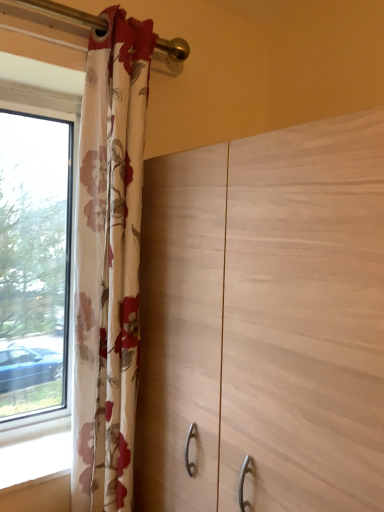
Locate an element on the screen. light wood dresser at center is located at coordinates (265, 321).

Describe the element at coordinates (265, 321) in the screenshot. I see `light wood dresser at center` at that location.

What do you see at coordinates (109, 263) in the screenshot? The image size is (384, 512). I see `floral fabric curtain at left` at bounding box center [109, 263].

At what (x,y) coordinates should I click in order to perform the action: click on floral fabric curtain at left. Please return your answer as a coordinate pair (x, y). Looking at the image, I should click on (109, 263).

Where is `light wood dresser at center`? light wood dresser at center is located at coordinates (265, 321).

Considering the positions of objects floral fabric curtain at left and light wood dresser at center in the image provided, who is more to the left, floral fabric curtain at left or light wood dresser at center?

floral fabric curtain at left.

Does floral fabric curtain at left come behind light wood dresser at center?

Yes, it is.

Between point (85, 433) and point (347, 429), which one is positioned behind?

The point (85, 433) is farther from the camera.

From the image's perspective, is floral fabric curtain at left located beneath light wood dresser at center?

Incorrect, from the image's perspective, floral fabric curtain at left is higher than light wood dresser at center.

From a real-world perspective, is floral fabric curtain at left above or below light wood dresser at center?

Clearly, from a real-world perspective, floral fabric curtain at left is above light wood dresser at center.

Considering the relative sizes of floral fabric curtain at left and light wood dresser at center in the image provided, is floral fabric curtain at left wider than light wood dresser at center?

In fact, floral fabric curtain at left might be narrower than light wood dresser at center.

Considering the relative sizes of floral fabric curtain at left and light wood dresser at center in the image provided, is floral fabric curtain at left shorter than light wood dresser at center?

No.

Which of these two, floral fabric curtain at left or light wood dresser at center, is bigger?

light wood dresser at center is bigger.

Is floral fabric curtain at left spatially inside light wood dresser at center, or outside of it?

floral fabric curtain at left cannot be found inside light wood dresser at center.

Is floral fabric curtain at left placed right next to light wood dresser at center?

No, floral fabric curtain at left is not next to light wood dresser at center.

Is floral fabric curtain at left oriented towards light wood dresser at center?

No, floral fabric curtain at left is not aimed at light wood dresser at center.

Where is `dresser below the floral fabric curtain at left (from the image's perspective)`? Image resolution: width=384 pixels, height=512 pixels. dresser below the floral fabric curtain at left (from the image's perspective) is located at coordinates (265, 321).

Between light wood dresser at center and floral fabric curtain at left, which one appears on the left side from the viewer's perspective?

floral fabric curtain at left is more to the left.

Is light wood dresser at center positioned behind floral fabric curtain at left?

No, light wood dresser at center is closer to the camera.

Does point (358, 451) come farther from viewer compared to point (137, 147)?

No.

In the scene shown: From the image's perspective, is light wood dresser at center located above or below floral fabric curtain at left?

From the image's perspective, light wood dresser at center appears below floral fabric curtain at left.

From a real-world perspective, is light wood dresser at center located beneath floral fabric curtain at left?

Correct, in the physical world, light wood dresser at center is lower than floral fabric curtain at left.

Considering the sizes of objects light wood dresser at center and floral fabric curtain at left in the image provided, who is wider, light wood dresser at center or floral fabric curtain at left?

light wood dresser at center.

Considering the sizes of objects light wood dresser at center and floral fabric curtain at left in the image provided, who is taller, light wood dresser at center or floral fabric curtain at left?

With more height is floral fabric curtain at left.

Can you confirm if light wood dresser at center is bigger than floral fabric curtain at left?

Yes, light wood dresser at center is bigger than floral fabric curtain at left.

Is floral fabric curtain at left a part of light wood dresser at center?

No, light wood dresser at center does not contain floral fabric curtain at left.

Is the surface of light wood dresser at center in direct contact with floral fabric curtain at left?

They are not placed beside each other.

Is light wood dresser at center oriented away from floral fabric curtain at left?

No, floral fabric curtain at left is not at the back of light wood dresser at center.

Can you tell me how much light wood dresser at center and floral fabric curtain at left differ in facing direction?

The angular difference between light wood dresser at center and floral fabric curtain at left is 90 degrees.

Measure the distance between light wood dresser at center and floral fabric curtain at left.

They are 23.74 centimeters apart.

Find the location of a particular element. The width and height of the screenshot is (384, 512). curtain lying above the light wood dresser at center (from the image's perspective) is located at coordinates (109, 263).

Find the location of `dresser beneath the floral fabric curtain at left (from a real-world perspective)`. dresser beneath the floral fabric curtain at left (from a real-world perspective) is located at coordinates (265, 321).

Where is `dresser in front of the floral fabric curtain at left`? This screenshot has width=384, height=512. dresser in front of the floral fabric curtain at left is located at coordinates (x=265, y=321).